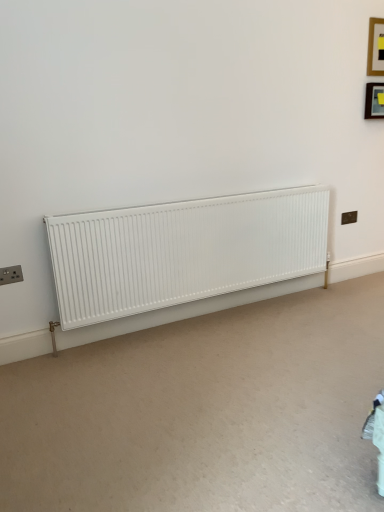
Question: Looking at the image, does matte black socket at lower left, which is the first electric outlet from front to back, seem bigger or smaller compared to black plastic electric outlet at upper right, the 2th electric outlet in the front-to-back sequence?

Choices:
 (A) big
 (B) small

Answer: (A)

Question: Considering their positions, is matte black socket at lower left, the first electric outlet from the left, located in front of or behind black plastic electric outlet at upper right, arranged as the second electric outlet when viewed from the left?

Choices:
 (A) behind
 (B) front

Answer: (B)

Question: Which is nearer to the matte black picture frame at upper right, which is counted as the 2th picture frame, starting from the top?

Choices:
 (A) wooden frame at upper right, placed as the second picture frame when sorted from bottom to top
 (B) white matte radiator at center
 (C) matte black socket at lower left, which is the second electric outlet in right-to-left order
 (D) black plastic electric outlet at upper right, the 2th electric outlet from the bottom

Answer: (A)

Question: Which is farther from the wooden frame at upper right, acting as the first picture frame starting from the top?

Choices:
 (A) matte black picture frame at upper right, which is counted as the 2th picture frame, starting from the top
 (B) matte black socket at lower left, the first electric outlet from the left
 (C) black plastic electric outlet at upper right, marked as the 1th electric outlet in a back-to-front arrangement
 (D) white matte radiator at center

Answer: (B)